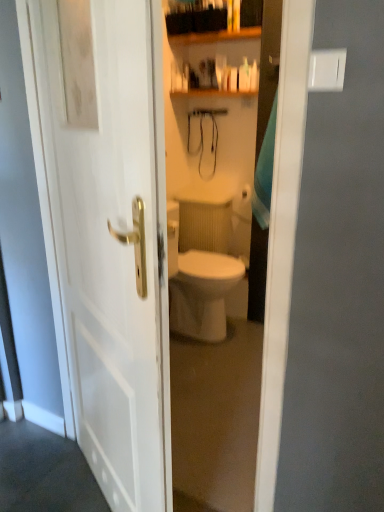
Question: Does white glossy soap dispenser at upper center have a larger size compared to white glossy door at center?

Choices:
 (A) no
 (B) yes

Answer: (A)

Question: Is white glossy soap dispenser at upper center further to the viewer compared to white glossy door at center?

Choices:
 (A) yes
 (B) no

Answer: (A)

Question: Can you confirm if white glossy soap dispenser at upper center is shorter than white glossy door at center?

Choices:
 (A) yes
 (B) no

Answer: (A)

Question: Would you say white glossy soap dispenser at upper center is outside white glossy door at center?

Choices:
 (A) no
 (B) yes

Answer: (B)

Question: Is white glossy soap dispenser at upper center to the left of white glossy door at center from the viewer's perspective?

Choices:
 (A) no
 (B) yes

Answer: (A)

Question: Could you tell me if white glossy soap dispenser at upper center is turned towards white glossy door at center?

Choices:
 (A) yes
 (B) no

Answer: (A)

Question: Is white glossy soap dispenser at upper center at the back of white glossy door at center?

Choices:
 (A) yes
 (B) no

Answer: (B)

Question: Is white glossy soap dispenser at upper center a part of white glossy door at center?

Choices:
 (A) yes
 (B) no

Answer: (B)

Question: Is white glossy door at center further to camera compared to white glossy soap dispenser at upper center?

Choices:
 (A) yes
 (B) no

Answer: (B)

Question: Is white glossy door at center to the right of white glossy soap dispenser at upper center from the viewer's perspective?

Choices:
 (A) no
 (B) yes

Answer: (A)

Question: Is white glossy door at center aimed at white glossy soap dispenser at upper center?

Choices:
 (A) no
 (B) yes

Answer: (B)

Question: From the image's perspective, is white glossy door at center above white glossy soap dispenser at upper center?

Choices:
 (A) no
 (B) yes

Answer: (A)

Question: From the image's perspective, is white glossy soap dispenser at upper center located above or below white glossy door at center?

Choices:
 (A) below
 (B) above

Answer: (B)